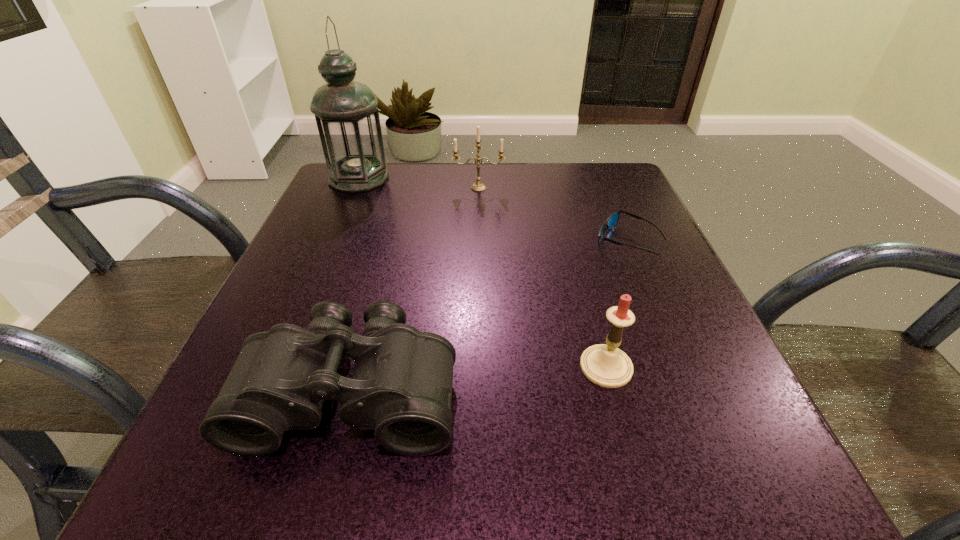
In order to click on blank space located at the front of the third nearest object showing the lenses in this screenshot , I will do `click(470, 241)`.

You are a GUI agent. You are given a task and a screenshot of the screen. Output one action in this format:
    pyautogui.click(x=<x>, y=<y>)
    Task: Click on the vacant position located at the front of the third nearest object showing the lenses
    
    Given the screenshot: What is the action you would take?
    pyautogui.click(x=417, y=241)

Identify the location of blank area located at the front of the third nearest object showing the lenses. Image resolution: width=960 pixels, height=540 pixels. (426, 241).

I want to click on oil lamp that is at the far edge, so [x=346, y=113].

What are the coordinates of `candle that is positioned at the far edge` in the screenshot? It's located at (478, 186).

Find the location of a particular element. The width and height of the screenshot is (960, 540). object positioned at the near edge is located at coordinates (401, 386).

You are a GUI agent. You are given a task and a screenshot of the screen. Output one action in this format:
    pyautogui.click(x=<x>, y=<y>)
    Task: Click on the oil lamp situated at the left edge
    This screenshot has width=960, height=540.
    Given the screenshot: What is the action you would take?
    pyautogui.click(x=346, y=113)

Find the location of `binoculars located at the left edge`. binoculars located at the left edge is located at coordinates (401, 386).

Where is `candle situated at the right edge`? The image size is (960, 540). candle situated at the right edge is located at coordinates tap(607, 366).

This screenshot has height=540, width=960. I want to click on sunglasses located at the right edge, so click(611, 222).